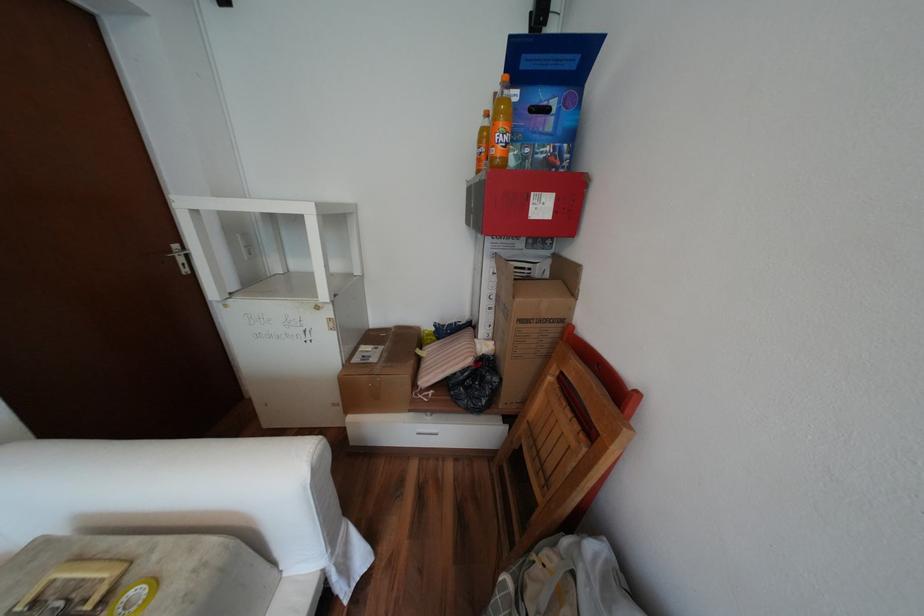
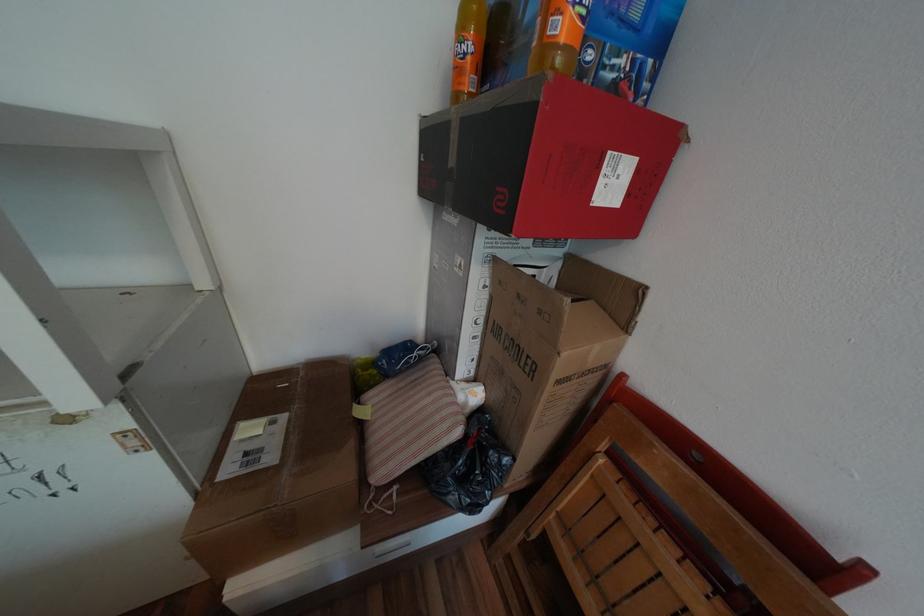
Where in the second image is the point corresponding to [391,347] from the first image?

(293, 416)